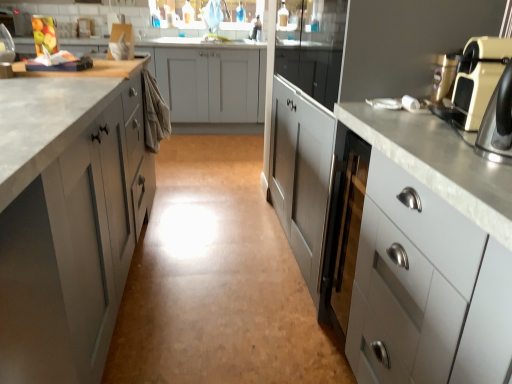
Question: Based on their sizes in the image, would you say beige plastic toaster at right is bigger or smaller than white glossy cabinet at right, which ranks as the third cabinetry in left-to-right order?

Choices:
 (A) big
 (B) small

Answer: (B)

Question: From their relative heights in the image, would you say beige plastic toaster at right is taller or shorter than white glossy cabinet at right, which ranks as the third cabinetry in left-to-right order?

Choices:
 (A) short
 (B) tall

Answer: (A)

Question: Estimate the real-world distances between objects in this image. Which object is farther from the matte silver faucet at upper center?

Choices:
 (A) metallic gold coffee machine at upper right
 (B) satin white cabinet at right, marked as the second cabinetry in a left-to-right arrangement
 (C) beige plastic toaster at right
 (D) white glossy cabinet at right, which ranks as the 1th cabinetry in right-to-left order
 (E) matte gray cabinet at left, which is counted as the first cabinetry, starting from the left

Answer: (D)

Question: Based on their relative distances, which object is nearer to the metallic gold coffee machine at upper right?

Choices:
 (A) beige plastic toaster at right
 (B) matte silver faucet at upper center
 (C) satin white cabinet at right, the 2th cabinetry from the right
 (D) white glossy cabinet at right, which ranks as the third cabinetry in left-to-right order
 (E) matte gray cabinet at left, which is counted as the first cabinetry, starting from the left

Answer: (A)